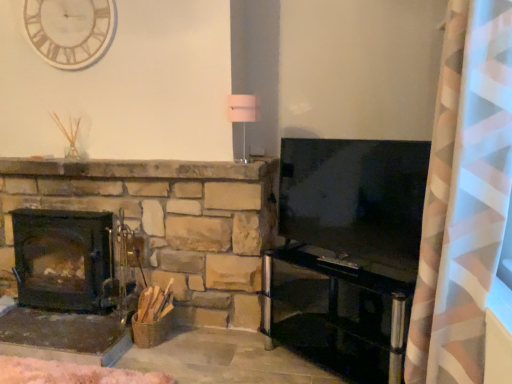
Question: Considering the relative sizes of white wooden clock at upper left and flat-screen tv at right in the image provided, is white wooden clock at upper left bigger than flat-screen tv at right?

Choices:
 (A) no
 (B) yes

Answer: (A)

Question: Are white wooden clock at upper left and flat-screen tv at right beside each other?

Choices:
 (A) yes
 (B) no

Answer: (B)

Question: Is white wooden clock at upper left taller than flat-screen tv at right?

Choices:
 (A) yes
 (B) no

Answer: (B)

Question: Is white wooden clock at upper left to the left of flat-screen tv at right from the viewer's perspective?

Choices:
 (A) yes
 (B) no

Answer: (A)

Question: Can you confirm if white wooden clock at upper left is shorter than flat-screen tv at right?

Choices:
 (A) no
 (B) yes

Answer: (B)

Question: Is white wooden clock at upper left to the left or to the right of flat-screen tv at right in the image?

Choices:
 (A) left
 (B) right

Answer: (A)

Question: From the image's perspective, relative to flat-screen tv at right, is white wooden clock at upper left above or below?

Choices:
 (A) above
 (B) below

Answer: (A)

Question: In terms of size, does white wooden clock at upper left appear bigger or smaller than flat-screen tv at right?

Choices:
 (A) big
 (B) small

Answer: (B)

Question: In terms of width, does white wooden clock at upper left look wider or thinner when compared to flat-screen tv at right?

Choices:
 (A) wide
 (B) thin

Answer: (B)

Question: Is transparent glass entertainment center at lower right in front of or behind white wooden clock at upper left in the image?

Choices:
 (A) behind
 (B) front

Answer: (B)

Question: In terms of width, does transparent glass entertainment center at lower right look wider or thinner when compared to white wooden clock at upper left?

Choices:
 (A) wide
 (B) thin

Answer: (A)

Question: Is transparent glass entertainment center at lower right to the left or to the right of white wooden clock at upper left in the image?

Choices:
 (A) right
 (B) left

Answer: (A)

Question: Which is correct: transparent glass entertainment center at lower right is inside white wooden clock at upper left, or outside of it?

Choices:
 (A) inside
 (B) outside

Answer: (B)

Question: Is point (364, 284) closer or farther from the camera than point (464, 175)?

Choices:
 (A) closer
 (B) farther

Answer: (B)

Question: Is transparent glass entertainment center at lower right wider or thinner than pink/white striped curtain at right?

Choices:
 (A) wide
 (B) thin

Answer: (B)